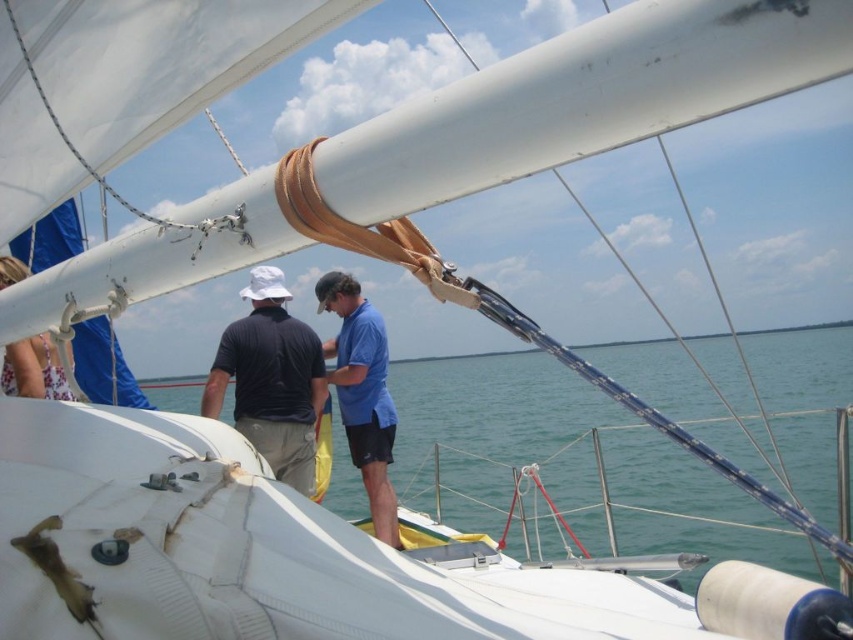
Question: Which point is closer to the camera taking this photo?

Choices:
 (A) (267, 406)
 (B) (357, 388)
 (C) (590, 416)

Answer: (A)

Question: Which object is the farthest from the blue matte shirt at center?

Choices:
 (A) blue water at center
 (B) matte black shirt at center

Answer: (A)

Question: Is matte black shirt at center positioned before blue matte shirt at center?

Choices:
 (A) yes
 (B) no

Answer: (A)

Question: Considering the relative positions of blue water at center and blue matte shirt at center in the image provided, where is blue water at center located with respect to blue matte shirt at center?

Choices:
 (A) right
 (B) left

Answer: (A)

Question: Which point is farther to the camera?

Choices:
 (A) (281, 380)
 (B) (393, 413)
 (C) (473, 416)

Answer: (C)

Question: From the image, what is the correct spatial relationship of blue water at center in relation to matte black shirt at center?

Choices:
 (A) below
 (B) above

Answer: (A)